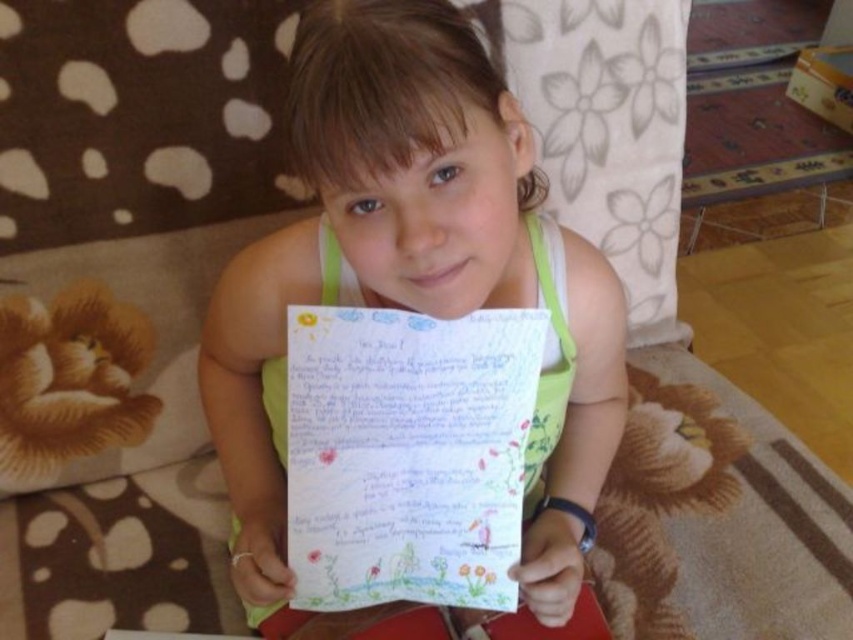
Who is higher up, green fabric shirt at center or colored paper at center?

green fabric shirt at center is higher up.

Does point (567, 262) come in front of point (392, 433)?

No.

From the picture: Who is more distant from viewer, (x=425, y=173) or (x=346, y=416)?

The point (x=346, y=416) is more distant.

Locate an element on the screen. The height and width of the screenshot is (640, 853). green fabric shirt at center is located at coordinates (415, 275).